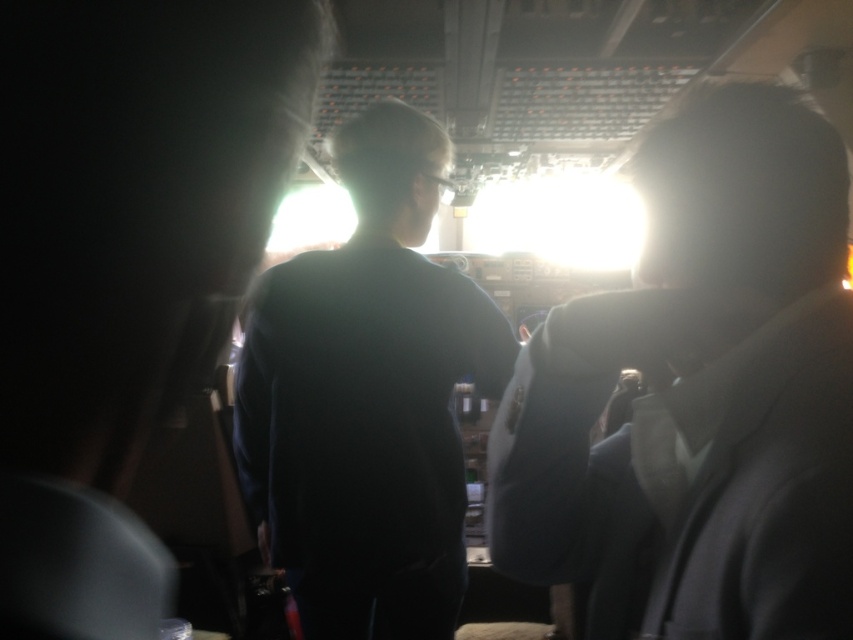
Question: Which point is closer to the camera?

Choices:
 (A) dark gray suit at right
 (B) dark matte shirt at center

Answer: (A)

Question: Does dark gray suit at right come in front of dark matte shirt at center?

Choices:
 (A) no
 (B) yes

Answer: (B)

Question: Among these objects, which one is nearest to the camera?

Choices:
 (A) matte black jacket at center
 (B) dark gray suit at right
 (C) dark matte shirt at center

Answer: (A)

Question: Among these objects, which one is farthest from the camera?

Choices:
 (A) dark gray suit at right
 (B) dark matte shirt at center
 (C) matte black jacket at center

Answer: (B)

Question: Can you confirm if dark gray suit at right is positioned to the right of matte black jacket at center?

Choices:
 (A) yes
 (B) no

Answer: (A)

Question: Does dark gray suit at right come behind matte black jacket at center?

Choices:
 (A) no
 (B) yes

Answer: (B)